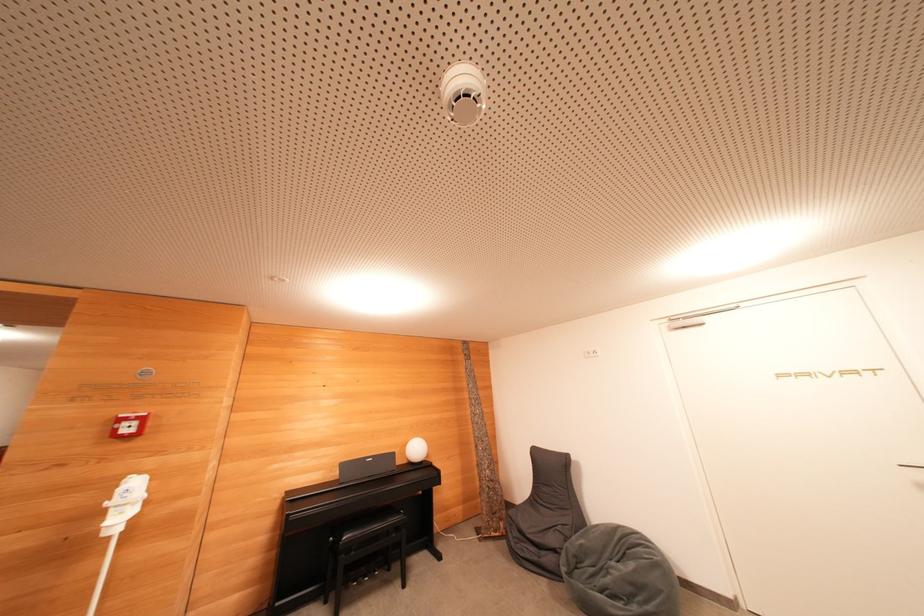
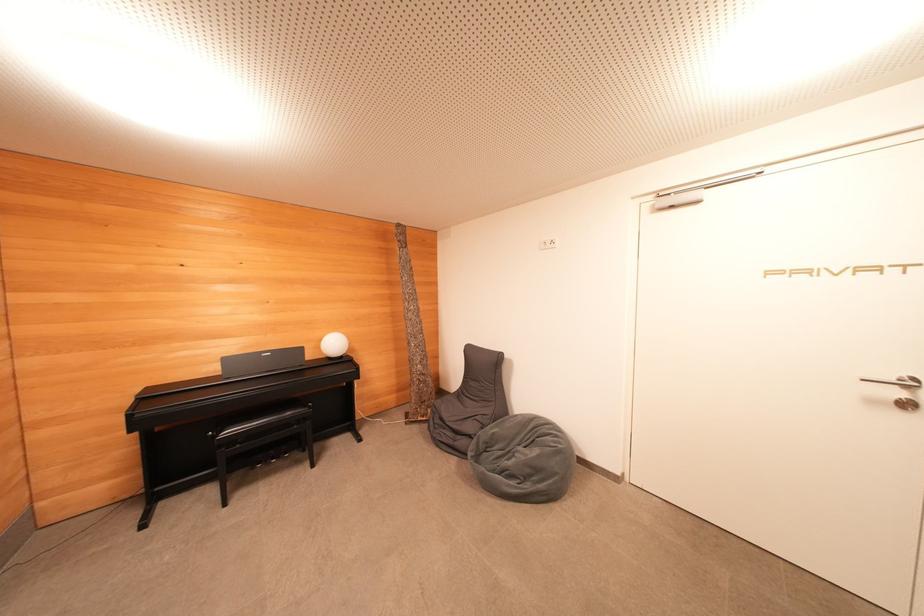
Question: How did the camera likely rotate?

Choices:
 (A) Left
 (B) Right
 (C) Up
 (D) Down

Answer: (D)